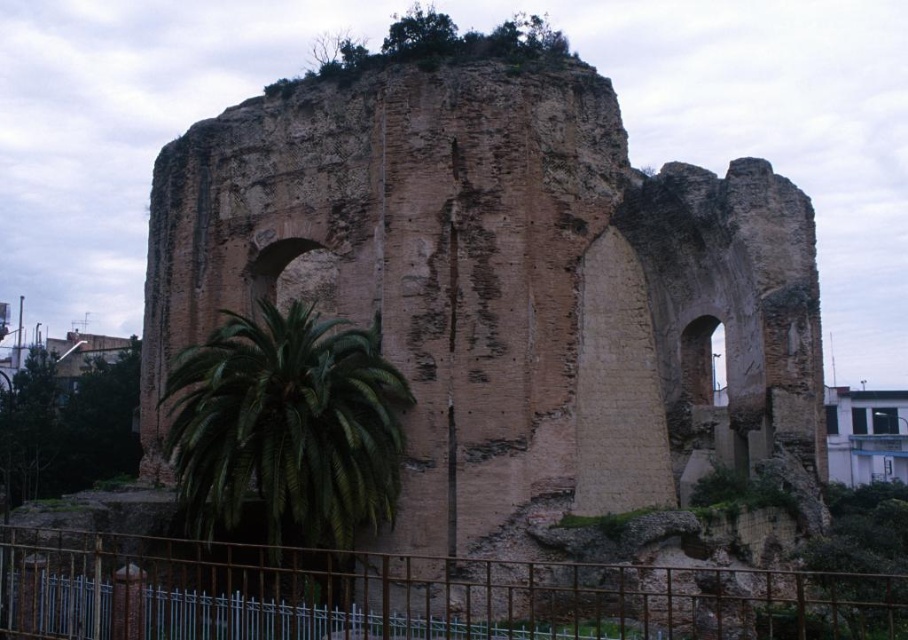
Who is taller, rusty metal fence at lower left or green leafy palm at lower left?

green leafy palm at lower left

Where is `rusty metal fence at lower left`? The width and height of the screenshot is (908, 640). rusty metal fence at lower left is located at coordinates (410, 595).

Who is positioned more to the right, brown stone ruins at center or rusty metal fence at lower left?

From the viewer's perspective, brown stone ruins at center appears more on the right side.

Is brown stone ruins at center to the right of rusty metal fence at lower left from the viewer's perspective?

Yes, brown stone ruins at center is to the right of rusty metal fence at lower left.

Locate an element on the screen. Image resolution: width=908 pixels, height=640 pixels. brown stone ruins at center is located at coordinates (498, 291).

Can you confirm if brown stone ruins at center is positioned to the left of green leafy palm at lower left?

In fact, brown stone ruins at center is to the right of green leafy palm at lower left.

Is point (485, 276) positioned behind point (326, 483)?

Yes, point (485, 276) is farther from viewer.

Find the location of a particular element. Image resolution: width=908 pixels, height=640 pixels. brown stone ruins at center is located at coordinates (498, 291).

Find the location of a particular element. The image size is (908, 640). brown stone ruins at center is located at coordinates (498, 291).